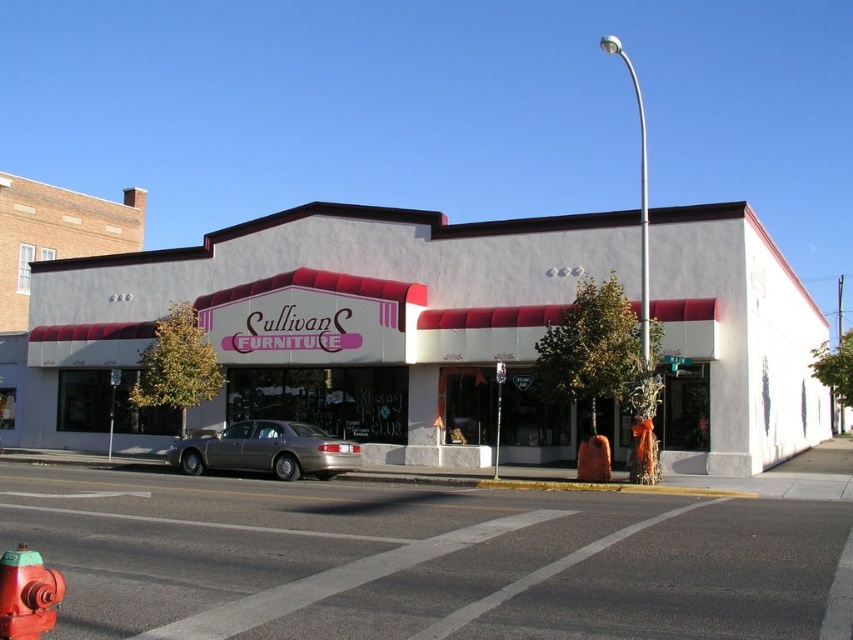
Question: Among these objects, which one is farthest from the camera?

Choices:
 (A) white matte building at center
 (B) gold metallic sedan at center
 (C) smooth asphalt road at center
 (D) red painted metal fire hydrant at lower left

Answer: (A)

Question: Among these objects, which one is farthest from the camera?

Choices:
 (A) white matte building at center
 (B) red painted metal fire hydrant at lower left
 (C) smooth asphalt road at center

Answer: (A)

Question: Does smooth asphalt road at center have a larger size compared to red painted metal fire hydrant at lower left?

Choices:
 (A) no
 (B) yes

Answer: (B)

Question: Does white matte building at center have a greater width compared to smooth asphalt road at center?

Choices:
 (A) no
 (B) yes

Answer: (B)

Question: Which object is positioned farthest from the red painted metal fire hydrant at lower left?

Choices:
 (A) gold metallic sedan at center
 (B) white matte building at center

Answer: (B)

Question: From the image, what is the correct spatial relationship of gold metallic sedan at center in relation to red painted metal fire hydrant at lower left?

Choices:
 (A) below
 (B) above

Answer: (A)